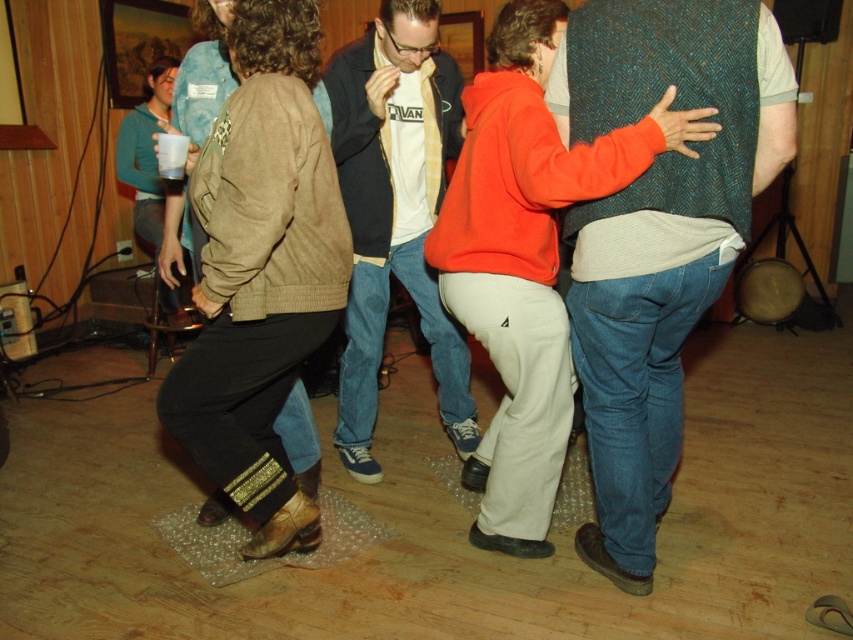
Question: Can you confirm if brown textured jacket at center is positioned below matte white shirt at center?

Choices:
 (A) yes
 (B) no

Answer: (A)

Question: Does green tweed vest at center have a smaller size compared to matte white shirt at center?

Choices:
 (A) yes
 (B) no

Answer: (B)

Question: Can you confirm if brown textured jacket at center is positioned above orange fleece jacket at center?

Choices:
 (A) no
 (B) yes

Answer: (A)

Question: Which of the following is the farthest from the observer?

Choices:
 (A) (229, 355)
 (B) (634, 237)
 (C) (347, 451)
 (D) (465, 470)

Answer: (C)

Question: Which of the following is the farthest from the observer?

Choices:
 (A) orange fleece jacket at center
 (B) matte white shirt at center
 (C) green tweed vest at center
 (D) brown textured jacket at center

Answer: (B)

Question: Which object is the closest to the brown textured jacket at center?

Choices:
 (A) orange fleece jacket at center
 (B) matte white shirt at center

Answer: (A)